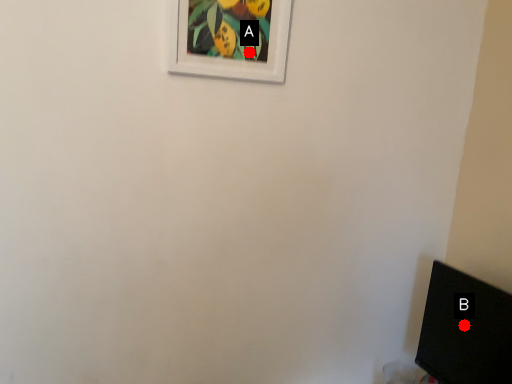
Question: Two points are circled on the image, labeled by A and B beside each circle. Which point is closer to the camera?

Choices:
 (A) A is closer
 (B) B is closer

Answer: (A)